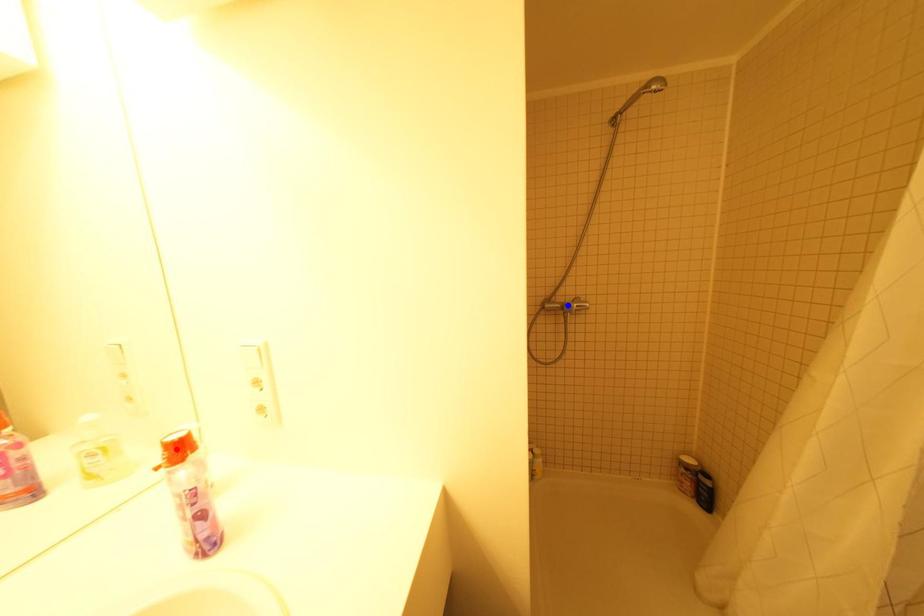
Question: In the image, two points are highlighted. Which point is nearer to the camera? Reply with the corresponding letter.

Choices:
 (A) blue point
 (B) red point

Answer: (B)